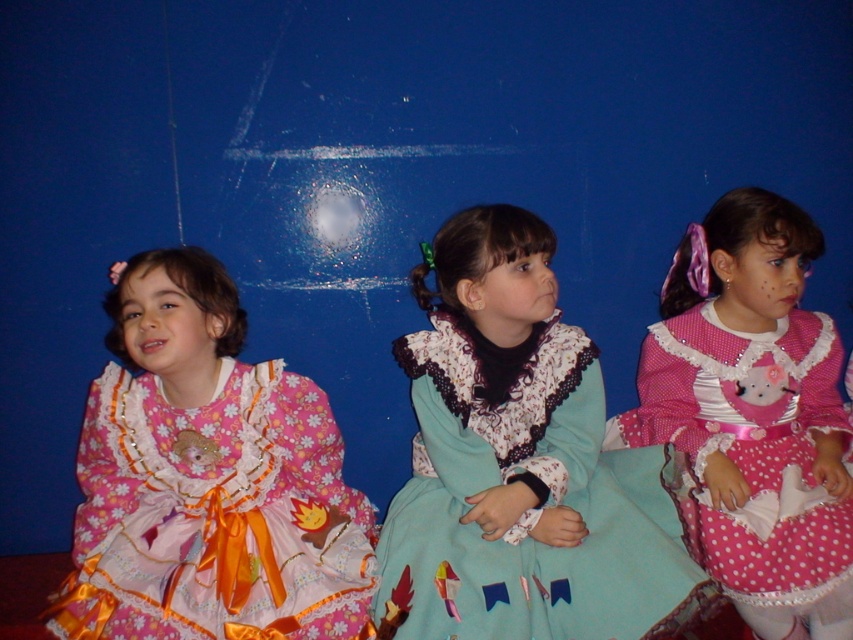
You are a photographer taking a photo of the three girls sitting against the blue wall. You need to place a decorative frame exactly at the center of the teal satin dress at center. According to the coordinates provided, where should you position the frame?

The frame should be placed at the coordinates point (529, 508), which is the exact 2D location of the teal satin dress at center.

You are a photographer setting up for a group photo. You want to ensure that both the pink satin dress at left and the teal satin dress at center are fully visible in the frame. Given their current positions, which dress might partially block the other, and what adjustment could you suggest to avoid this?

The teal satin dress at center is currently behind the pink satin dress at left, so it might be partially blocked. To ensure both are fully visible, suggest moving the teal satin dress at center slightly forward or adjusting the camera angle to capture both dresses without obstruction.